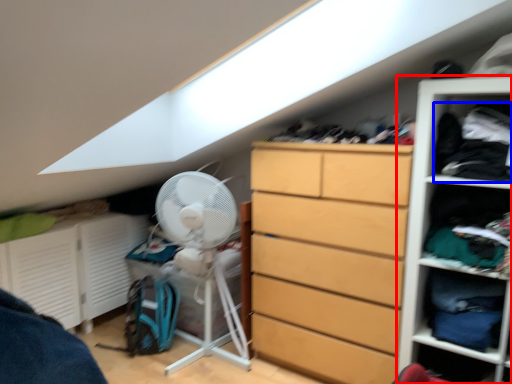
Question: Which point is closer to the camera, shelf (highlighted by a red box) or clothing (highlighted by a blue box)?

Choices:
 (A) shelf
 (B) clothing

Answer: (A)